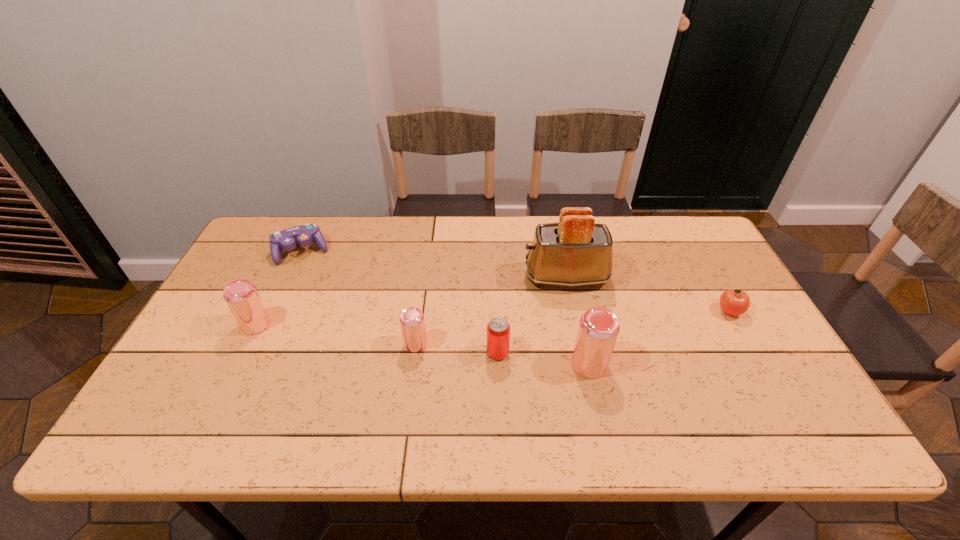
Where is `vacant region that satisfies the following two spatial constraints: 1. on the back side of the second beer can from left to right; 2. on the right side of the apple`? vacant region that satisfies the following two spatial constraints: 1. on the back side of the second beer can from left to right; 2. on the right side of the apple is located at coordinates (420, 312).

Identify the location of vacant region that satisfies the following two spatial constraints: 1. on the front side of the second shortest object; 2. on the left side of the control. The image size is (960, 540). (274, 312).

Locate an element on the screen. free spot that satisfies the following two spatial constraints: 1. on the side of the toaster with the control lever; 2. on the front side of the fourth object from left to right is located at coordinates (582, 353).